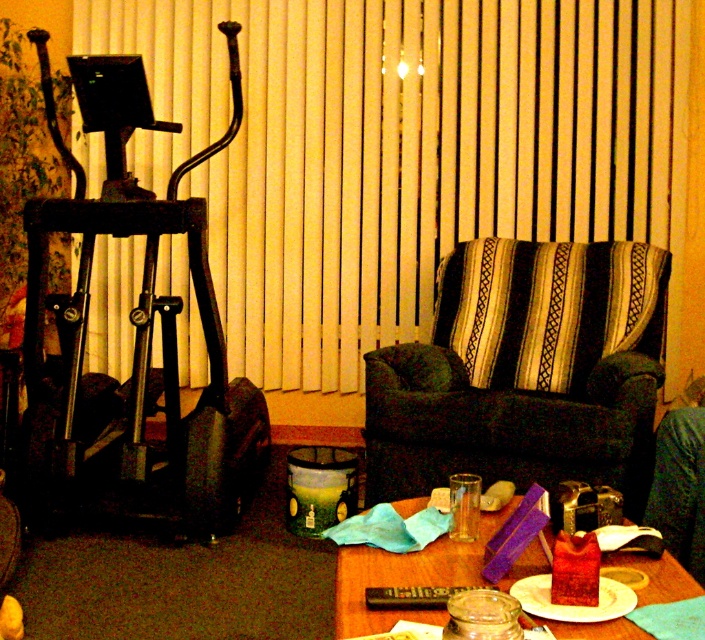
Question: Is yellow fabric blind at upper center thinner than translucent glass jar at center?

Choices:
 (A) no
 (B) yes

Answer: (A)

Question: Is metallic black elliptical trainer at left behind translucent glass jar at center?

Choices:
 (A) yes
 (B) no

Answer: (A)

Question: Which point appears farthest from the camera in this image?

Choices:
 (A) (240, 435)
 (B) (496, 518)
 (C) (398, 260)

Answer: (C)

Question: Based on their relative distances, which object is nearer to the metallic black elliptical trainer at left?

Choices:
 (A) yellow fabric blind at upper center
 (B) translucent glass jar at center

Answer: (A)

Question: Is dark green fabric armchair at center smaller than translucent glass jar at center?

Choices:
 (A) yes
 (B) no

Answer: (B)

Question: Estimate the real-world distances between objects in this image. Which object is farther from the metallic black elliptical trainer at left?

Choices:
 (A) yellow fabric blind at upper center
 (B) translucent glass jar at center

Answer: (B)